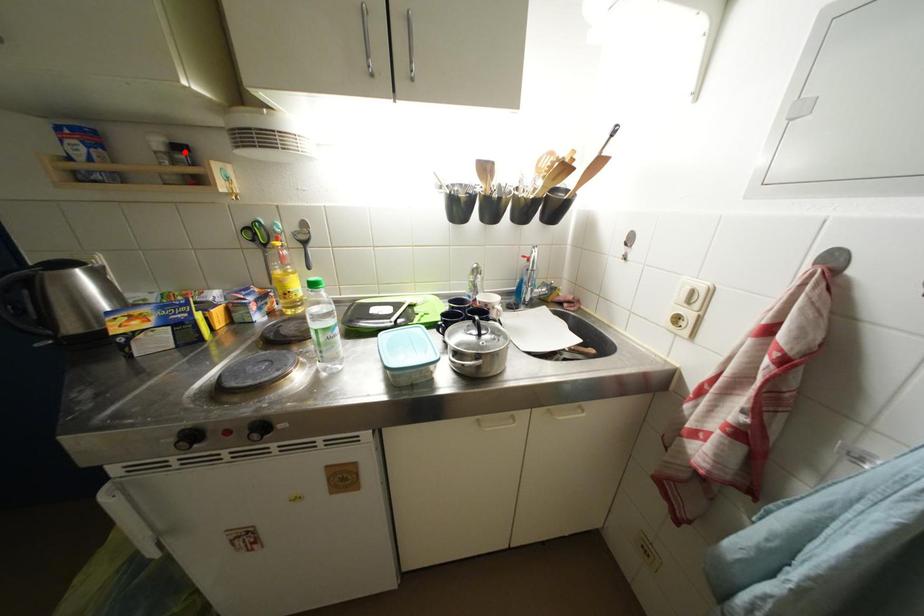
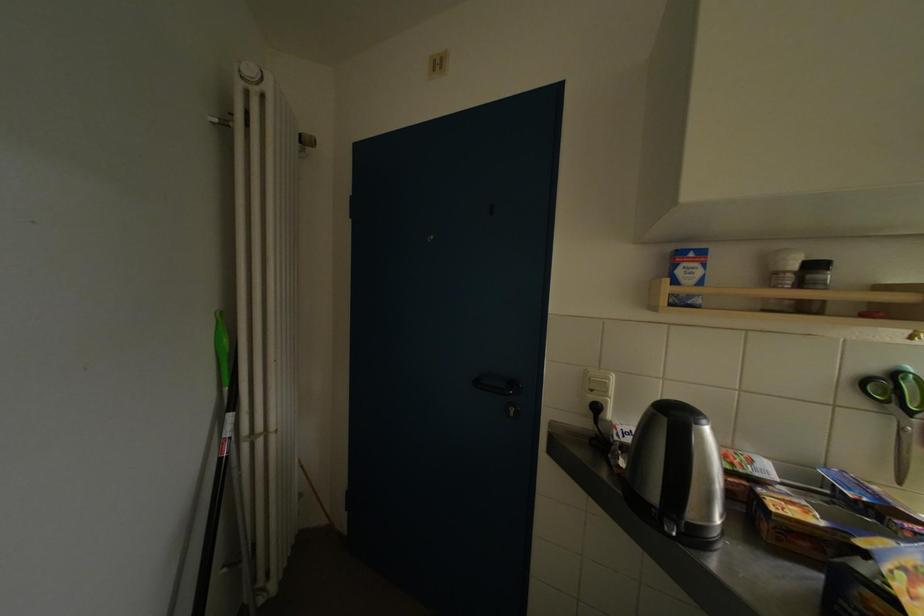
The point at the highlighted location is marked in the first image. Where is the corresponding point in the second image?

(821, 270)